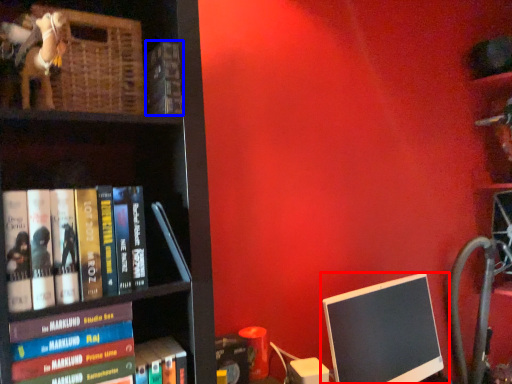
Question: Among these objects, which one is farthest to the camera, computer monitor (highlighted by a red box) or book (highlighted by a blue box)?

Choices:
 (A) computer monitor
 (B) book

Answer: (A)